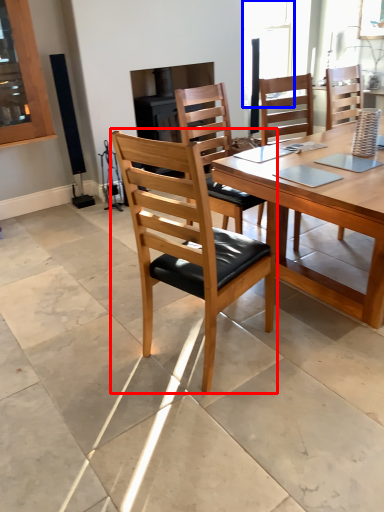
Question: Which point is further to the camera, chair (highlighted by a red box) or window (highlighted by a blue box)?

Choices:
 (A) chair
 (B) window

Answer: (B)